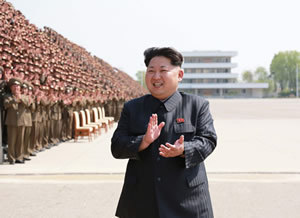
Find the location of a particular element. The image size is (300, 218). backs of chairs is located at coordinates (76, 116), (83, 117), (88, 116), (97, 115), (100, 113), (105, 112).